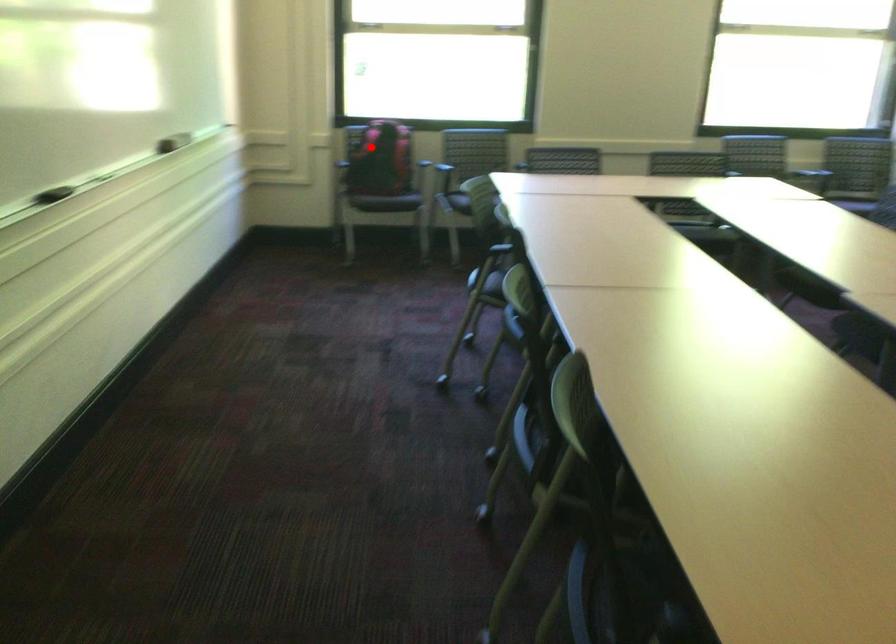
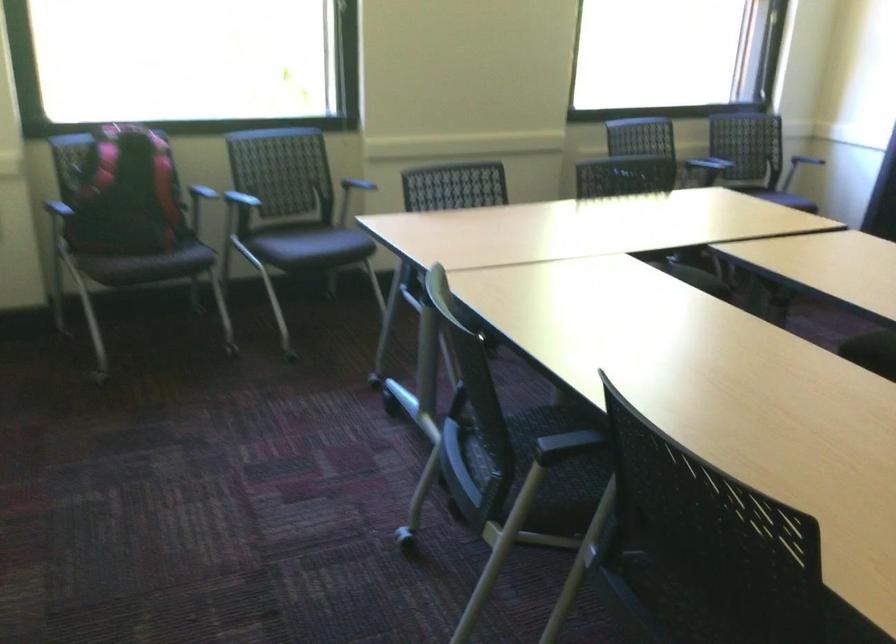
Question: I am providing you with two images of the same scene from different viewpoints. A red point is shown in image1. For the corresponding object point in image2, is it positioned nearer or farther from the camera?

Choices:
 (A) Nearer
 (B) Farther

Answer: (A)